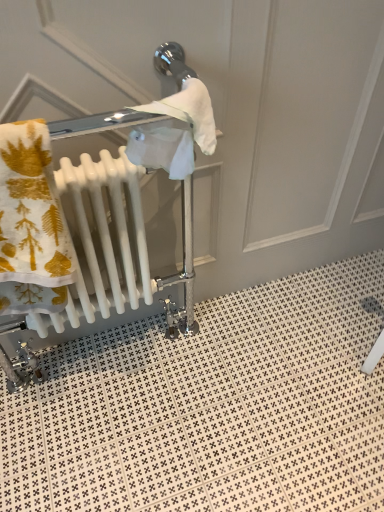
Image resolution: width=384 pixels, height=512 pixels. What do you see at coordinates (102, 239) in the screenshot? I see `white glossy radiator at left` at bounding box center [102, 239].

Where is `white glossy radiator at left`? white glossy radiator at left is located at coordinates (102, 239).

From the picture: In order to face white glossy tile at lower center, should I rotate leftwards or rightwards?

You should rotate right by 8.854 degrees.

The height and width of the screenshot is (512, 384). Describe the element at coordinates (212, 407) in the screenshot. I see `white glossy tile at lower center` at that location.

The image size is (384, 512). What are the coordinates of `white glossy tile at lower center` in the screenshot? It's located at (212, 407).

This screenshot has height=512, width=384. Identify the location of white glossy radiator at left. (102, 239).

Considering the positions of objects white glossy radiator at left and white glossy tile at lower center in the image provided, who is more to the right, white glossy radiator at left or white glossy tile at lower center?

Positioned to the right is white glossy tile at lower center.

Is the position of white glossy radiator at left less distant than that of white glossy tile at lower center?

Yes, white glossy radiator at left is in front of white glossy tile at lower center.

Does point (124, 213) come behind point (140, 499)?

No.

From the image's perspective, between white glossy radiator at left and white glossy tile at lower center, who is located below?

white glossy tile at lower center.

Based on the photo, from a real-world perspective, is white glossy radiator at left physically above white glossy tile at lower center?

Indeed, from a real-world perspective, white glossy radiator at left stands above white glossy tile at lower center.

Looking at their sizes, would you say white glossy radiator at left is wider or thinner than white glossy tile at lower center?

In the image, white glossy radiator at left appears to be more narrow than white glossy tile at lower center.

Is white glossy radiator at left taller or shorter than white glossy tile at lower center?

In the image, white glossy radiator at left appears to be taller than white glossy tile at lower center.

Between white glossy radiator at left and white glossy tile at lower center, which one has larger size?

With larger size is white glossy tile at lower center.

Would you say white glossy tile at lower center is part of white glossy radiator at left's contents?

Definitely not — white glossy tile at lower center is not inside white glossy radiator at left.

Is white glossy radiator at left with white glossy tile at lower center?

white glossy radiator at left is not next to white glossy tile at lower center, and they're not touching.

Is white glossy radiator at left positioned with its back to white glossy tile at lower center?

No, white glossy tile at lower center is not at the back of white glossy radiator at left.

Can you tell me how much white glossy radiator at left and white glossy tile at lower center differ in facing direction?

The angle between the facing direction of white glossy radiator at left and the facing direction of white glossy tile at lower center is 89.4 degrees.

How much distance is there between white glossy radiator at left and white glossy tile at lower center?

19.82 inches.

You are a GUI agent. You are given a task and a screenshot of the screen. Output one action in this format:
    pyautogui.click(x=<x>, y=<y>)
    Task: Click on the tile below the white glossy radiator at left (from the image's perspective)
    Image resolution: width=384 pixels, height=512 pixels.
    Given the screenshot: What is the action you would take?
    pyautogui.click(x=212, y=407)

Is white glossy tile at lower center at the left side of white glossy radiator at left?

No.

Is white glossy tile at lower center in front of or behind white glossy radiator at left in the image?

white glossy tile at lower center is positioned farther from the viewer than white glossy radiator at left.

Which point is more forward, (82, 444) or (102, 233)?

The point (102, 233) is closer to the camera.

From the image's perspective, is white glossy tile at lower center beneath white glossy radiator at left?

Indeed, from the image's perspective, white glossy tile at lower center is shown beneath white glossy radiator at left.

From a real-world perspective, which is physically below, white glossy tile at lower center or white glossy radiator at left?

From a 3D spatial view, white glossy tile at lower center is below.

Which object is wider, white glossy tile at lower center or white glossy radiator at left?

Wider between the two is white glossy tile at lower center.

From their relative heights in the image, would you say white glossy tile at lower center is taller or shorter than white glossy radiator at left?

Considering their sizes, white glossy tile at lower center has less height than white glossy radiator at left.

Is white glossy tile at lower center bigger than white glossy radiator at left?

Yes.

Is white glossy tile at lower center inside the boundaries of white glossy radiator at left, or outside?

white glossy tile at lower center is located beyond the bounds of white glossy radiator at left.

From the picture: Are white glossy tile at lower center and white glossy radiator at left located far from each other?

No, white glossy tile at lower center is not far away from white glossy radiator at left.

Is white glossy tile at lower center oriented away from white glossy radiator at left?

No, white glossy tile at lower center's orientation is not away from white glossy radiator at left.

Image resolution: width=384 pixels, height=512 pixels. Identify the location of tile lying behind the white glossy radiator at left. (212, 407).

Locate an element on the screen. radiator above the white glossy tile at lower center (from a real-world perspective) is located at coordinates (102, 239).

Locate an element on the screen. This screenshot has width=384, height=512. radiator that is on the left side of white glossy tile at lower center is located at coordinates (102, 239).